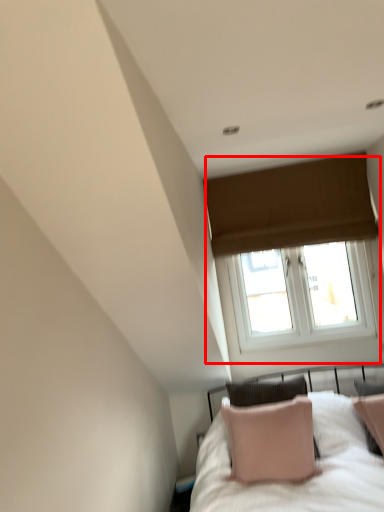
Question: From the image, what is the correct spatial relationship of window (annotated by the red box) in relation to bed?

Choices:
 (A) right
 (B) left

Answer: (A)